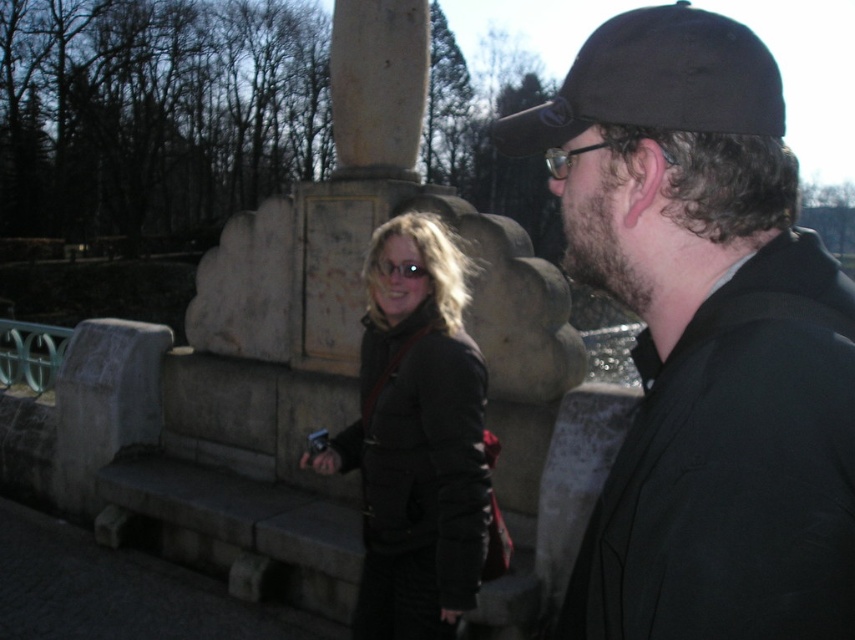
Who is taller, black matte cap at upper right or black fabric baseball cap at upper right?

Standing taller between the two is black fabric baseball cap at upper right.

Between black matte cap at upper right and black fabric baseball cap at upper right, which one is positioned higher?

Positioned higher is black fabric baseball cap at upper right.

The width and height of the screenshot is (855, 640). What do you see at coordinates (705, 339) in the screenshot? I see `black matte cap at upper right` at bounding box center [705, 339].

I want to click on black matte cap at upper right, so click(705, 339).

Is black matte cap at upper right to the left of matte black jacket at center from the viewer's perspective?

In fact, black matte cap at upper right is to the right of matte black jacket at center.

Does black matte cap at upper right have a greater height compared to matte black jacket at center?

No, black matte cap at upper right is not taller than matte black jacket at center.

Identify the location of black matte cap at upper right. (705, 339).

Locate an element on the screen. The width and height of the screenshot is (855, 640). black matte cap at upper right is located at coordinates (705, 339).

At what (x,y) coordinates should I click in order to perform the action: click on matte black jacket at center. Please return your answer as a coordinate pair (x, y). The width and height of the screenshot is (855, 640). Looking at the image, I should click on (416, 438).

Can you confirm if matte black jacket at center is positioned below black fabric baseball cap at upper right?

Yes.

Does point (381, 429) come in front of point (615, 84)?

No, it is behind (615, 84).

Where is `matte black jacket at center`? matte black jacket at center is located at coordinates (416, 438).